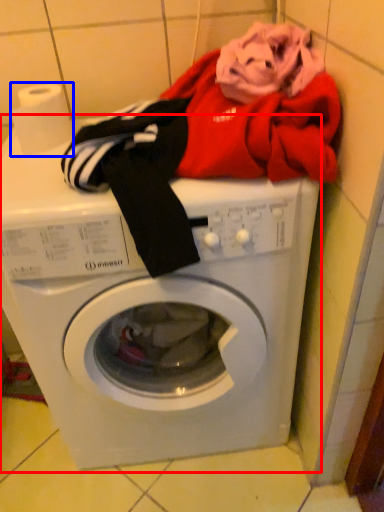
Question: Which of the following is the closest to the observer, washing machine (highlighted by a red box) or toilet paper (highlighted by a blue box)?

Choices:
 (A) washing machine
 (B) toilet paper

Answer: (A)